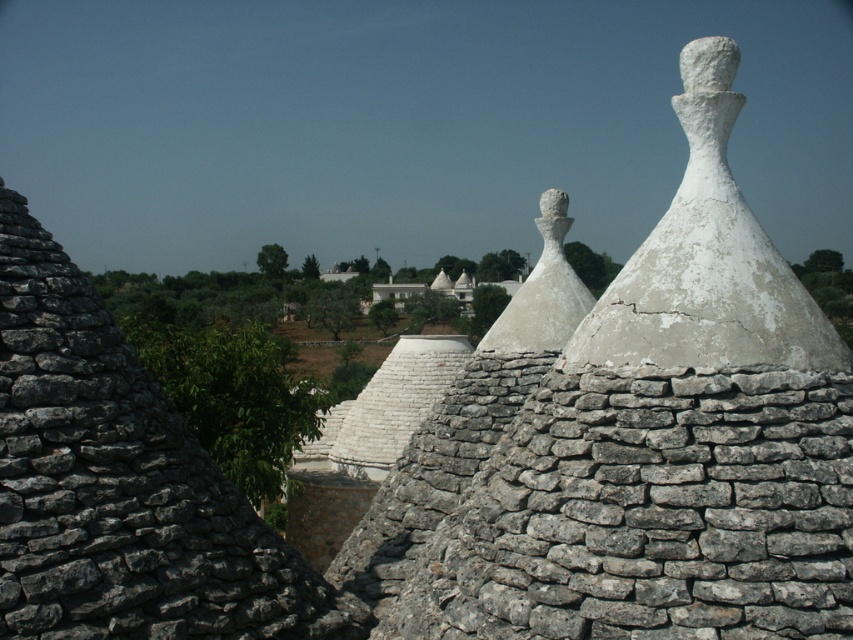
Question: Which object appears farthest from the camera in this image?

Choices:
 (A) white stone statue at center
 (B) white cracked stone cone at center

Answer: (A)

Question: Does white cracked stone cone at center have a greater width compared to white stone statue at center?

Choices:
 (A) yes
 (B) no

Answer: (A)

Question: Can you confirm if white cracked stone cone at center is wider than white stone statue at center?

Choices:
 (A) yes
 (B) no

Answer: (A)

Question: Does white cracked stone cone at center have a smaller size compared to white stone statue at center?

Choices:
 (A) yes
 (B) no

Answer: (B)

Question: Which point is farther to the camera?

Choices:
 (A) (558, 216)
 (B) (643, 305)

Answer: (A)

Question: Which point is farther to the camera?

Choices:
 (A) (680, 60)
 (B) (537, 280)

Answer: (A)